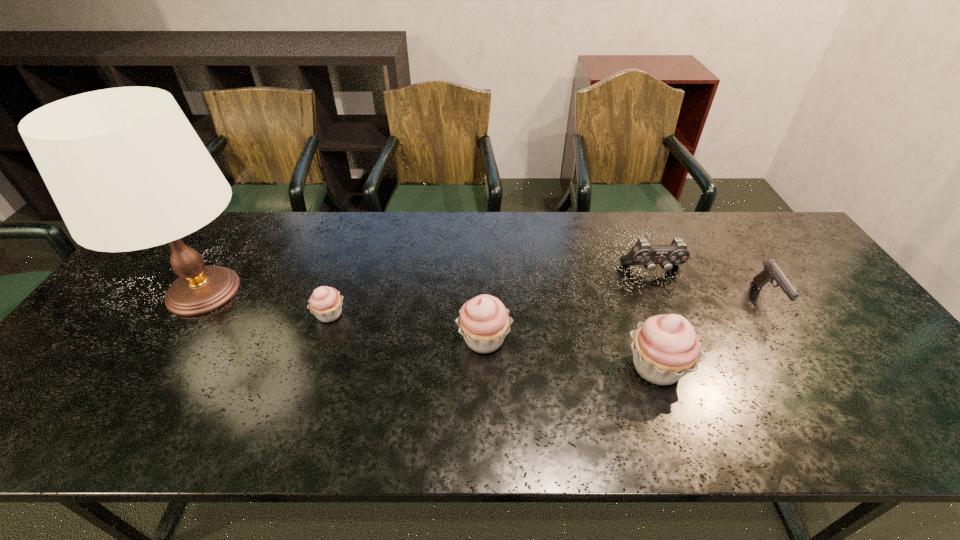
This screenshot has width=960, height=540. What are the coordinates of `the second object from left to right` in the screenshot? It's located at (325, 303).

Locate an element on the screen. The image size is (960, 540). the shortest cupcake is located at coordinates (325, 303).

You are a GUI agent. You are given a task and a screenshot of the screen. Output one action in this format:
    pyautogui.click(x=<x>, y=<y>)
    Task: Click on the fourth shortest object
    This screenshot has height=540, width=960.
    Given the screenshot: What is the action you would take?
    pyautogui.click(x=484, y=321)

You are a GUI agent. You are given a task and a screenshot of the screen. Output one action in this format:
    pyautogui.click(x=<x>, y=<y>)
    Task: Click on the second cupcake from left to right
    
    Given the screenshot: What is the action you would take?
    pyautogui.click(x=484, y=321)

You are a GUI agent. You are given a task and a screenshot of the screen. Output one action in this format:
    pyautogui.click(x=<x>, y=<y>)
    Task: Click on the rightmost cupcake
    The height and width of the screenshot is (540, 960).
    Given the screenshot: What is the action you would take?
    pyautogui.click(x=665, y=348)

In order to click on control in this screenshot , I will do `click(642, 253)`.

What are the coordinates of `the tallest object` in the screenshot? It's located at (127, 171).

Where is `the leftmost object`? This screenshot has width=960, height=540. the leftmost object is located at coordinates (127, 171).

Locate an element on the screen. The height and width of the screenshot is (540, 960). pistol is located at coordinates (771, 271).

The image size is (960, 540). In order to click on vacant space located 0.130m on the left of the leftmost cupcake in this screenshot , I will do (263, 314).